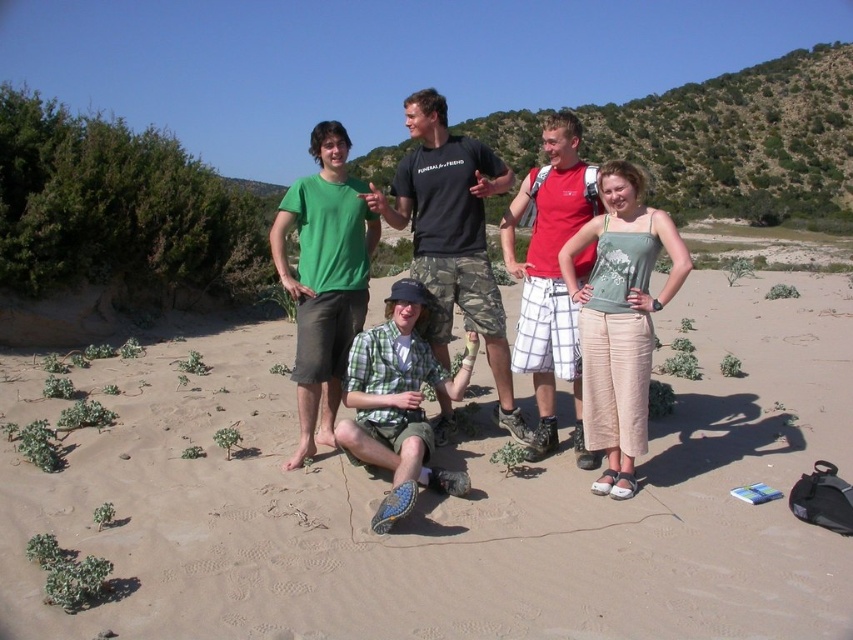
Question: Which object is positioned farthest from the light green fabric tank top at center?

Choices:
 (A) beige sandy beach at center
 (B) black camo shorts at center
 (C) red plaid shorts at center

Answer: (B)

Question: Is light green fabric tank top at center above black camo shorts at center?

Choices:
 (A) no
 (B) yes

Answer: (A)

Question: Is beige sandy beach at center further to the viewer compared to black camo shorts at center?

Choices:
 (A) no
 (B) yes

Answer: (A)

Question: Based on their relative distances, which object is nearer to the black camo shorts at center?

Choices:
 (A) beige sandy beach at center
 (B) light green fabric tank top at center
 (C) red plaid shorts at center

Answer: (C)

Question: Is the position of light green fabric tank top at center more distant than that of black camo shorts at center?

Choices:
 (A) no
 (B) yes

Answer: (A)

Question: Which point is closer to the camera?

Choices:
 (A) (715, 573)
 (B) (453, 134)

Answer: (A)